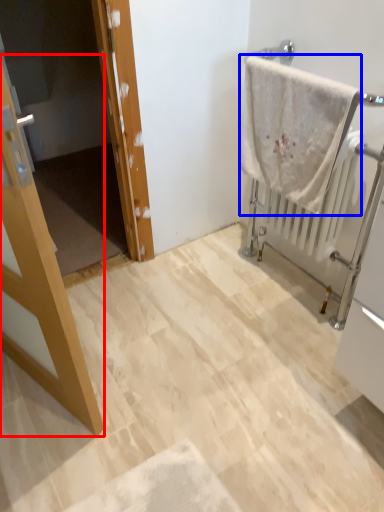
Question: Which of the following is the farthest to the observer, door (highlighted by a red box) or towel (highlighted by a blue box)?

Choices:
 (A) door
 (B) towel

Answer: (B)